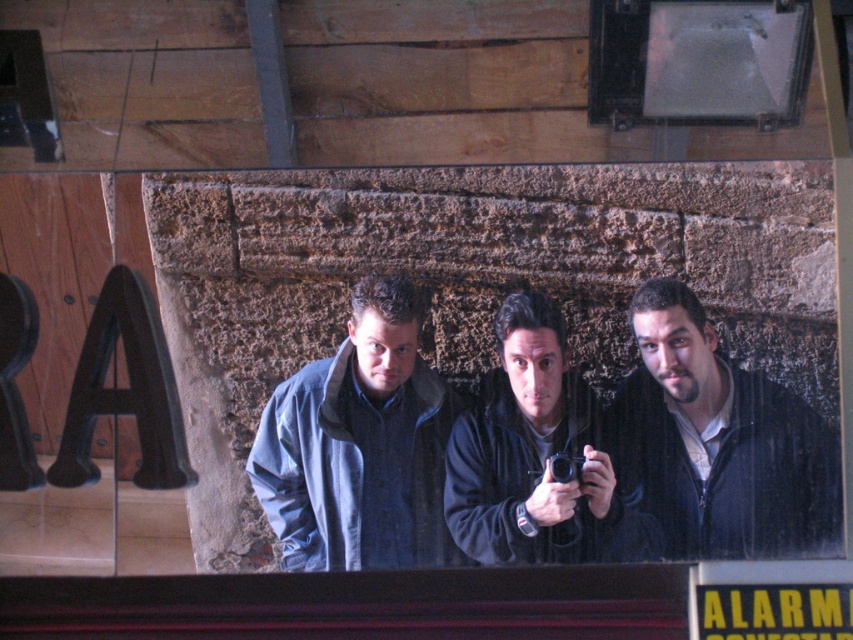
You are trying to decide which jacket to borrow from your friends. Both the denim jacket at center and the dark blue fleece jacket at center are available. Which one is bigger?

The denim jacket at center is larger in size than the dark blue fleece jacket at center, so you should choose the denim jacket at center.

You are trying to decide which jacket to choose between the denim jacket at center and the dark blue fleece jacket at center based on their width. According to the image, which one is wider?

The denim jacket at center is wider than the dark blue fleece jacket at center.